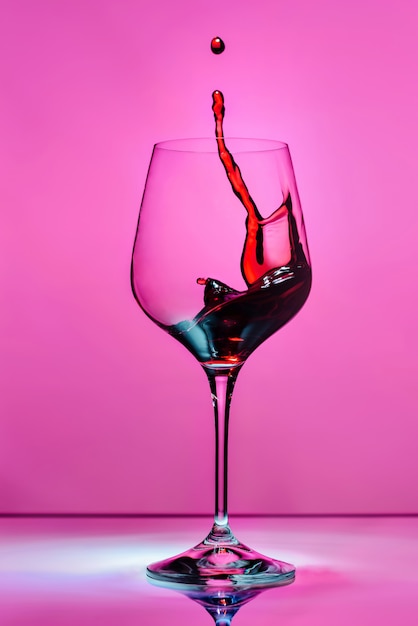
Locate an element on the screen. Image resolution: width=418 pixels, height=626 pixels. wine glass is located at coordinates (219, 414).